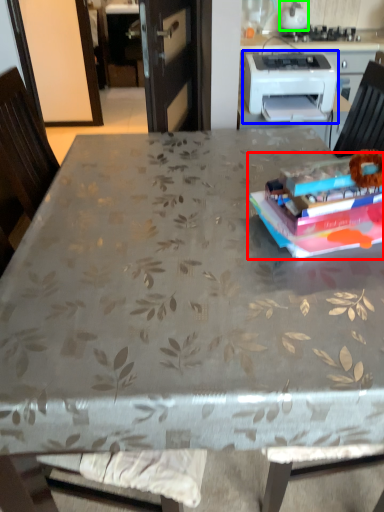
Question: Considering the real-world distances, which object is farthest from paperback book (highlighted by a red box)? printer (highlighted by a blue box) or kitchen appliance (highlighted by a green box)?

Choices:
 (A) printer
 (B) kitchen appliance

Answer: (B)